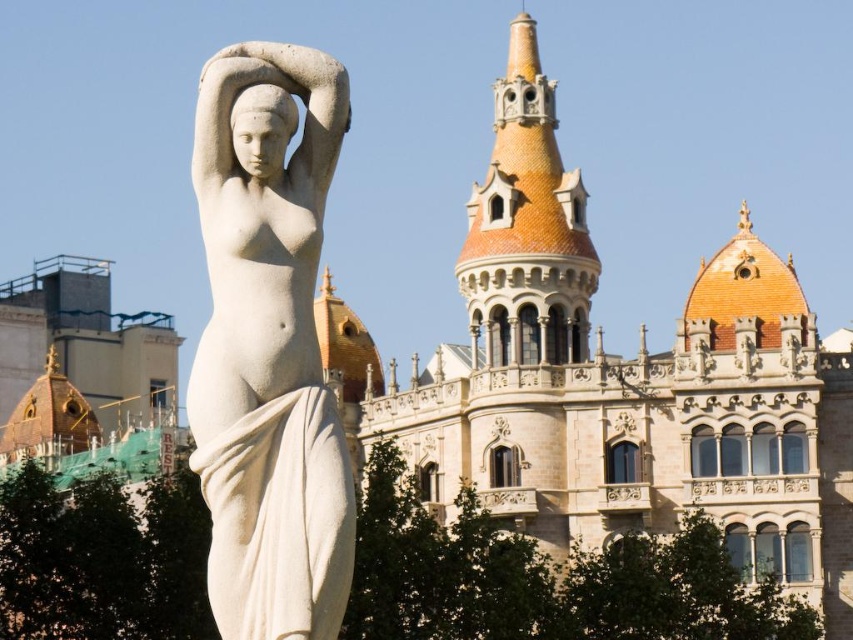
Question: Which of the following is the closest to the observer?

Choices:
 (A) white marble statue at center
 (B) brown stone palace at center

Answer: (A)

Question: Considering the relative positions of brown stone palace at center and white marble statue at center in the image provided, where is brown stone palace at center located with respect to white marble statue at center?

Choices:
 (A) below
 (B) above

Answer: (B)

Question: Is brown stone palace at center to the right of terracotta tiled tower at upper center from the viewer's perspective?

Choices:
 (A) yes
 (B) no

Answer: (A)

Question: Which of the following is the farthest from the observer?

Choices:
 (A) white marble statue at center
 (B) terracotta tiled tower at upper center

Answer: (B)

Question: Considering the real-world distances, which object is closest to the white marble statue at center?

Choices:
 (A) terracotta tiled tower at upper center
 (B) brown stone palace at center

Answer: (B)

Question: Considering the relative positions of brown stone palace at center and white marble statue at center in the image provided, where is brown stone palace at center located with respect to white marble statue at center?

Choices:
 (A) left
 (B) right

Answer: (B)